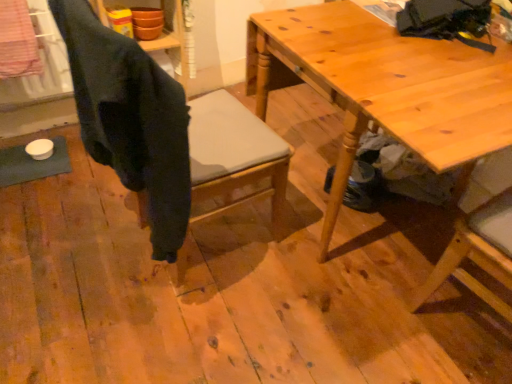
The image size is (512, 384). I want to click on vacant space positioned to the left of dark gray fabric chair at center, so click(79, 236).